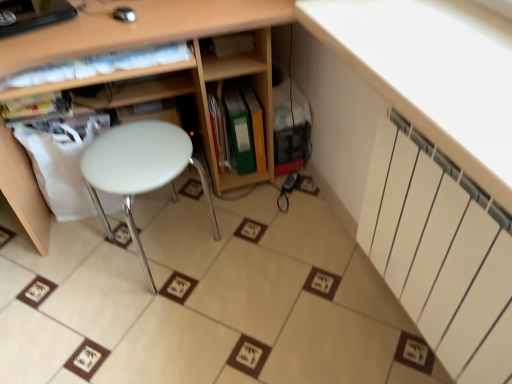
Where is `free location to the left of white plastic stool at center`? free location to the left of white plastic stool at center is located at coordinates (65, 276).